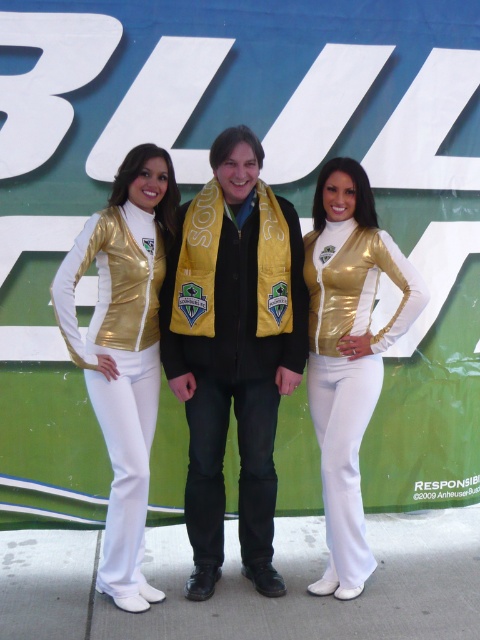
You are a photographer adjusting your camera settings to focus on the shiny yellow scarf at center and the metallic gold vest at center. Which object should you adjust your focus to first if you want to capture both in sharp detail?

You should focus on the shiny yellow scarf at center first because it is closer to the viewer than the metallic gold vest at center, allowing you to adjust focus accordingly for both objects.